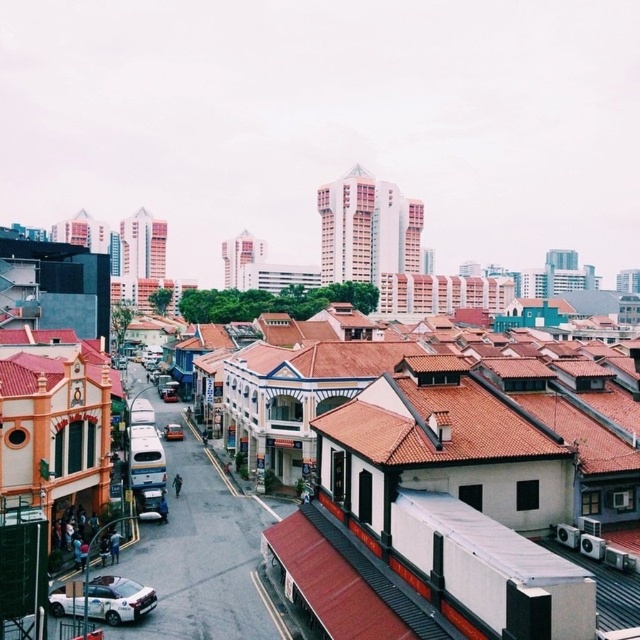
Can you confirm if white glossy car at lower left is positioned to the left of metallic silver car at center?

Incorrect, white glossy car at lower left is not on the left side of metallic silver car at center.

Which is below, white glossy car at lower left or metallic silver car at center?

white glossy car at lower left is lower down.

At what (x,y) coordinates should I click in order to perform the action: click on white glossy car at lower left. Please return your answer as a coordinate pair (x, y). This screenshot has height=640, width=640. Looking at the image, I should click on (118, 600).

Find the location of `white glossy car at lower left`. white glossy car at lower left is located at coordinates (118, 600).

Can you confirm if white glossy car at lower left is taller than shiny red car at center?

Yes.

Is white glossy car at lower left positioned in front of shiny red car at center?

Yes, it is in front of shiny red car at center.

The width and height of the screenshot is (640, 640). In order to click on white glossy car at lower left in this screenshot , I will do `click(118, 600)`.

Image resolution: width=640 pixels, height=640 pixels. What do you see at coordinates (172, 432) in the screenshot?
I see `shiny red car at center` at bounding box center [172, 432].

Does shiny red car at center have a lesser width compared to metallic silver car at center?

Yes, shiny red car at center is thinner than metallic silver car at center.

Is point (170, 440) more distant than point (170, 392)?

No, (170, 440) is closer to viewer.

This screenshot has height=640, width=640. Identify the location of shiny red car at center. (172, 432).